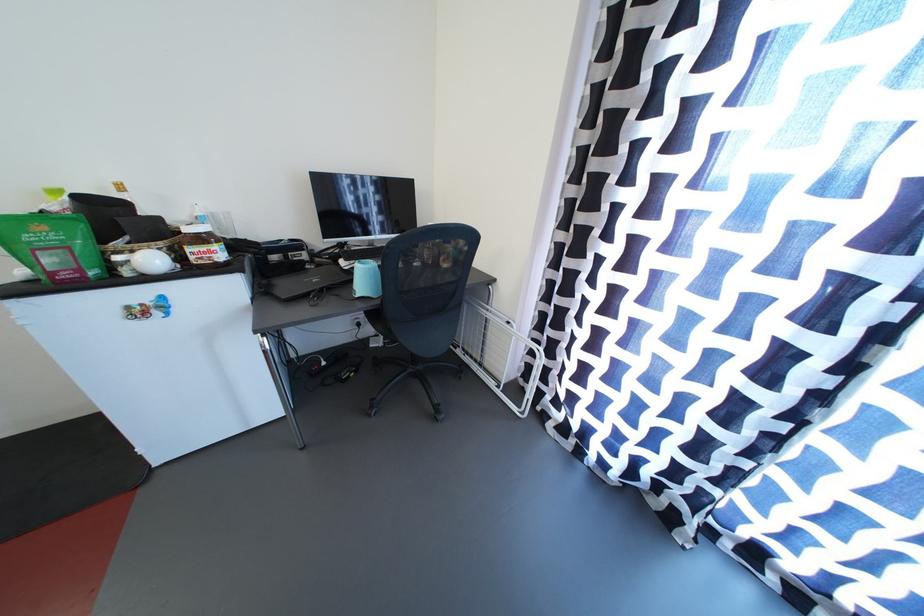
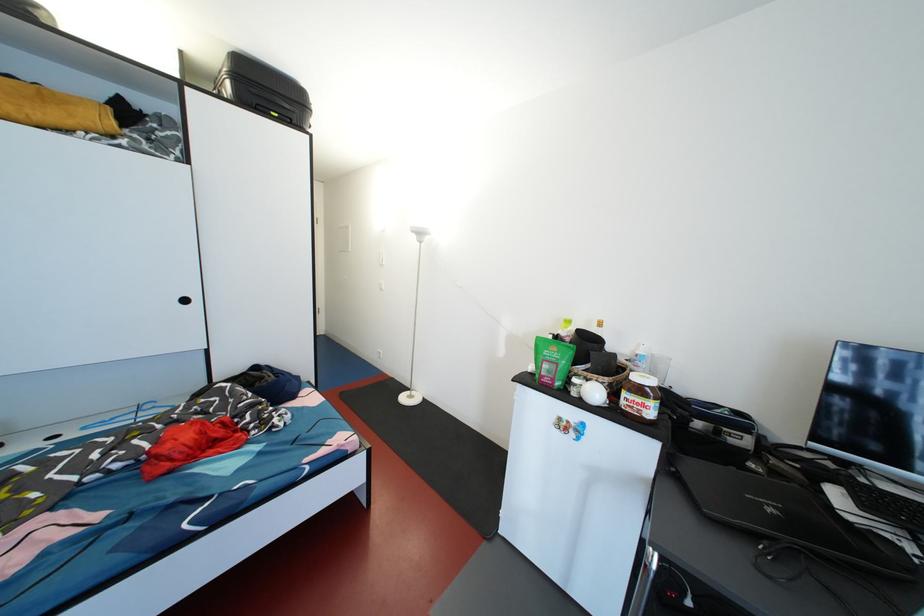
The point at (166, 224) is marked in the first image. Where is the corresponding point in the second image?

(621, 360)